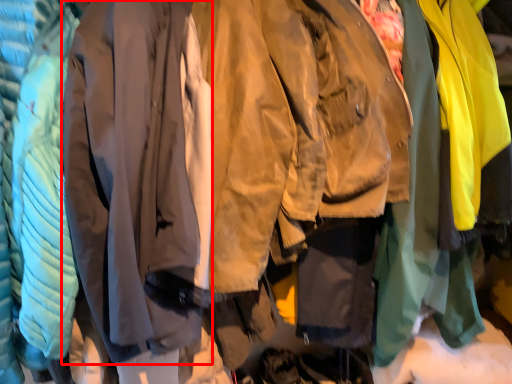
Question: In this image, where is sweatshirt (annotated by the red box) located relative to sweatshirt?

Choices:
 (A) right
 (B) left

Answer: (B)